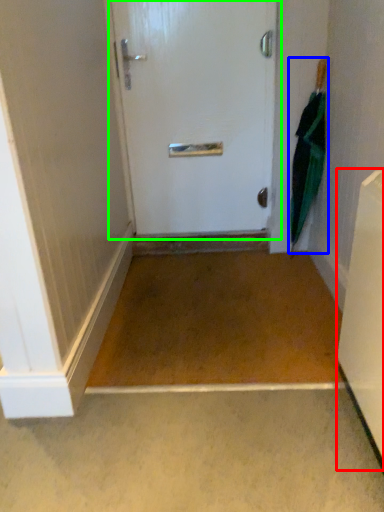
Question: Estimate the real-world distances between objects in this image. Which object is farther from appliance (highlighted by a red box), umbrella (highlighted by a blue box) or door (highlighted by a green box)?

Choices:
 (A) umbrella
 (B) door

Answer: (B)